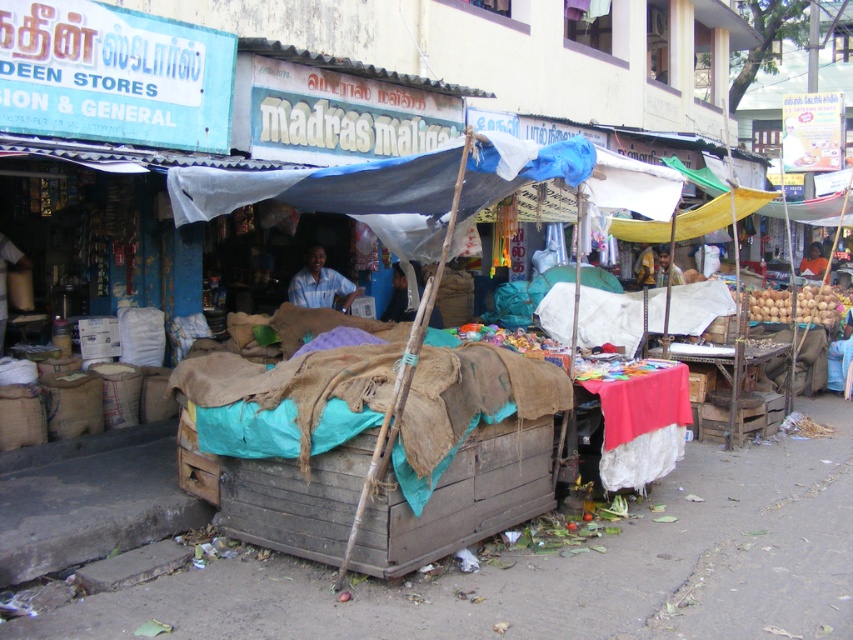
Question: Is brown wooden crate at lower center above blue fabric at center?

Choices:
 (A) yes
 (B) no

Answer: (B)

Question: Can you confirm if brown wooden crate at lower center is bigger than blue fabric at center?

Choices:
 (A) yes
 (B) no

Answer: (B)

Question: Can you confirm if brown wooden crate at lower center is bigger than blue fabric at center?

Choices:
 (A) no
 (B) yes

Answer: (A)

Question: Among these objects, which one is nearest to the camera?

Choices:
 (A) brown wooden crate at lower center
 (B) blue fabric at center

Answer: (A)

Question: Which of the following is the farthest from the observer?

Choices:
 (A) brown wooden crate at lower center
 (B) blue fabric at center

Answer: (B)